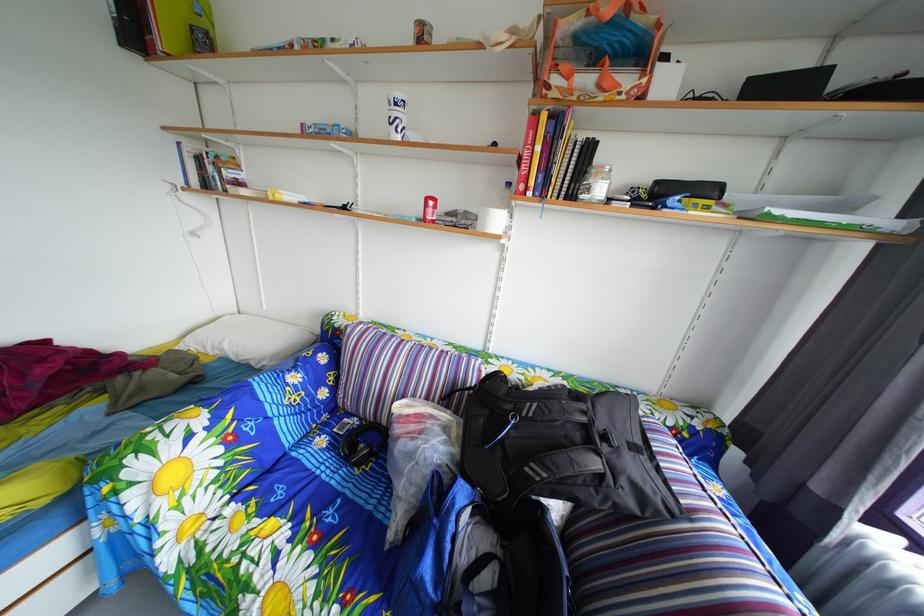
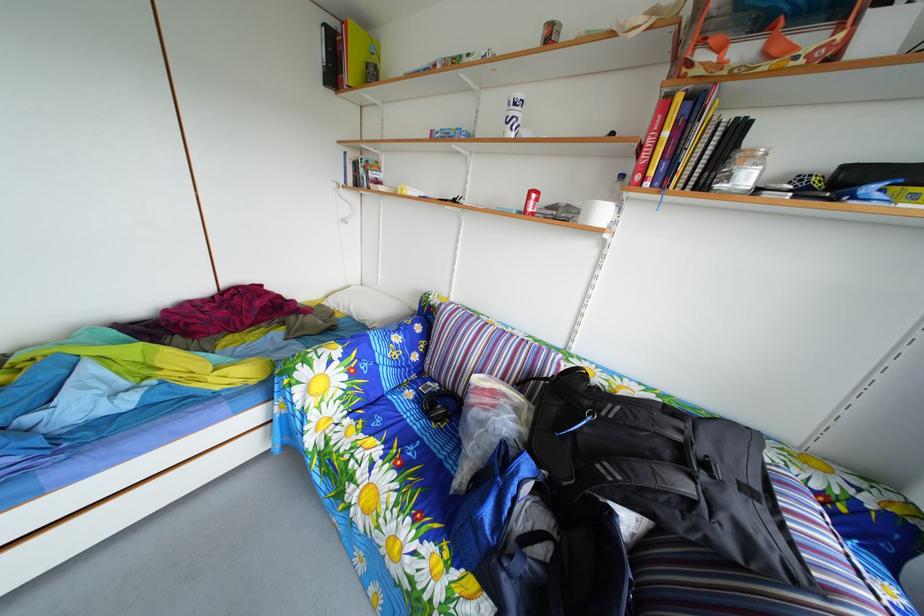
Question: In a continuous first-person perspective shot, in which direction is the camera moving?

Choices:
 (A) Left
 (B) Right
 (C) Forward
 (D) Backward

Answer: (D)